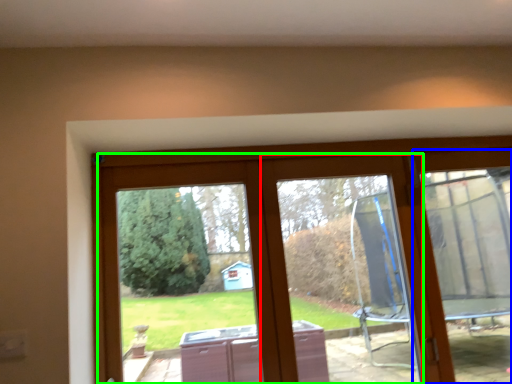
Question: Which object is positioned closest to window frame (highlighted by a red box)? Select from screen door (highlighted by a blue box) and glass door (highlighted by a green box).

Choices:
 (A) screen door
 (B) glass door

Answer: (B)